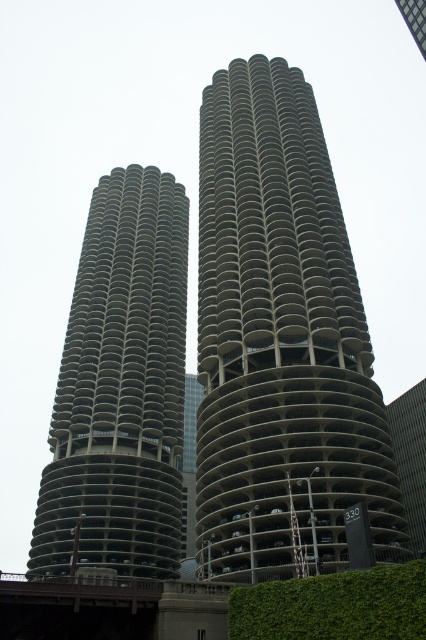
Consider the image. Does gray concrete building at center appear on the left side of gray concrete building at left?

Incorrect, gray concrete building at center is not on the left side of gray concrete building at left.

Can you confirm if gray concrete building at center is positioned to the right of gray concrete building at left?

Yes, gray concrete building at center is to the right of gray concrete building at left.

Which is in front, point (230, 125) or point (132, 256)?

Point (230, 125) is more forward.

Identify the location of gray concrete building at center. This screenshot has height=640, width=426. (281, 340).

Who is higher up, gray concrete building at center or green leafy hedge at lower right?

gray concrete building at center is higher up.

Can you confirm if gray concrete building at center is wider than green leafy hedge at lower right?

Correct, the width of gray concrete building at center exceeds that of green leafy hedge at lower right.

Image resolution: width=426 pixels, height=640 pixels. I want to click on gray concrete building at center, so click(x=281, y=340).

Which of these two, gray concrete building at left or green leafy hedge at lower right, stands shorter?

green leafy hedge at lower right

Does point (163, 552) come farther from viewer compared to point (250, 588)?

Yes, point (163, 552) is behind point (250, 588).

At what (x,y) coordinates should I click in order to perform the action: click on gray concrete building at left. Please return your answer as a coordinate pair (x, y). The height and width of the screenshot is (640, 426). Looking at the image, I should click on (120, 387).

This screenshot has height=640, width=426. What are the coordinates of `gray concrete building at left` in the screenshot? It's located at (120, 387).